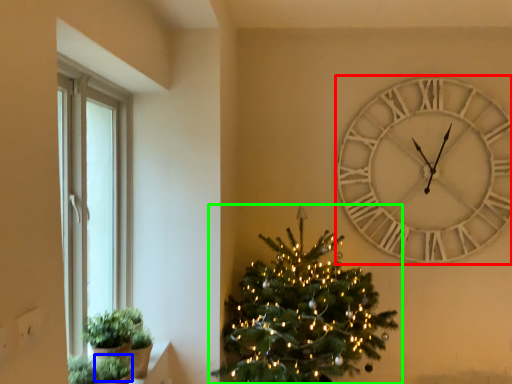
Question: Which object is the farthest from wall clock (highlighted by a red box)? Choose among these: plant (highlighted by a blue box) or christmas tree (highlighted by a green box).

Choices:
 (A) plant
 (B) christmas tree

Answer: (A)